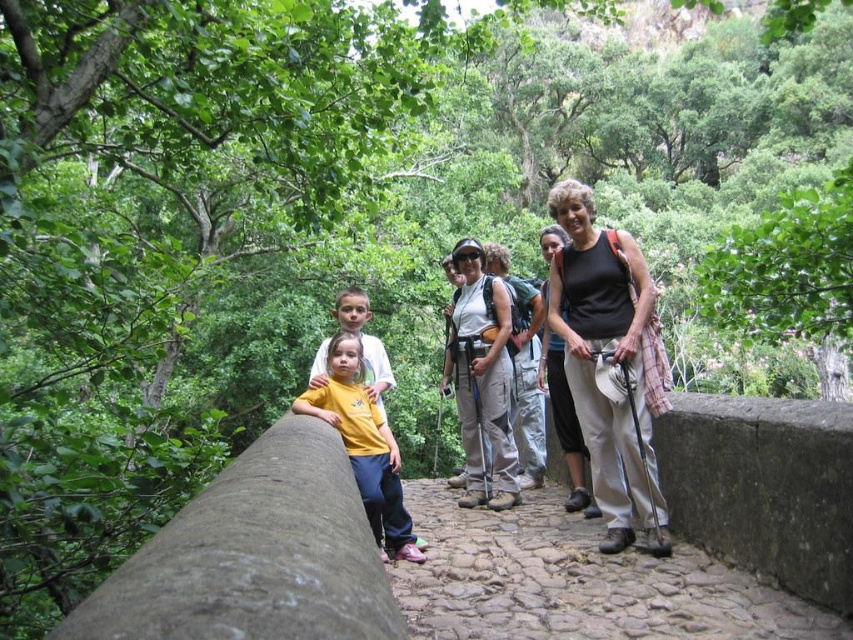
Can you confirm if matte white hiking poles at center is smaller than yellow matte shirt at center?

Incorrect, matte white hiking poles at center is not smaller in size than yellow matte shirt at center.

Is matte white hiking poles at center in front of yellow matte shirt at center?

No, it is behind yellow matte shirt at center.

Where is `matte white hiking poles at center`? Image resolution: width=853 pixels, height=640 pixels. matte white hiking poles at center is located at coordinates (611, 358).

What are the coordinates of `matte white hiking poles at center` in the screenshot? It's located at (611, 358).

Is the position of cobblestone path at center more distant than that of matte white hiking poles at center?

No, it is in front of matte white hiking poles at center.

Does cobblestone path at center appear over matte white hiking poles at center?

Actually, cobblestone path at center is below matte white hiking poles at center.

Who is more distant from viewer, (567, 611) or (665, 513)?

Point (665, 513)

Image resolution: width=853 pixels, height=640 pixels. Find the location of `cobblestone path at center`. cobblestone path at center is located at coordinates (577, 580).

Between cobblestone path at center and matte black tank top at center, which one appears on the left side from the viewer's perspective?

Positioned to the left is matte black tank top at center.

Between point (752, 582) and point (642, 460), which one is positioned in front?

Point (752, 582) is more forward.

Identify the location of cobblestone path at center. The image size is (853, 640). (577, 580).